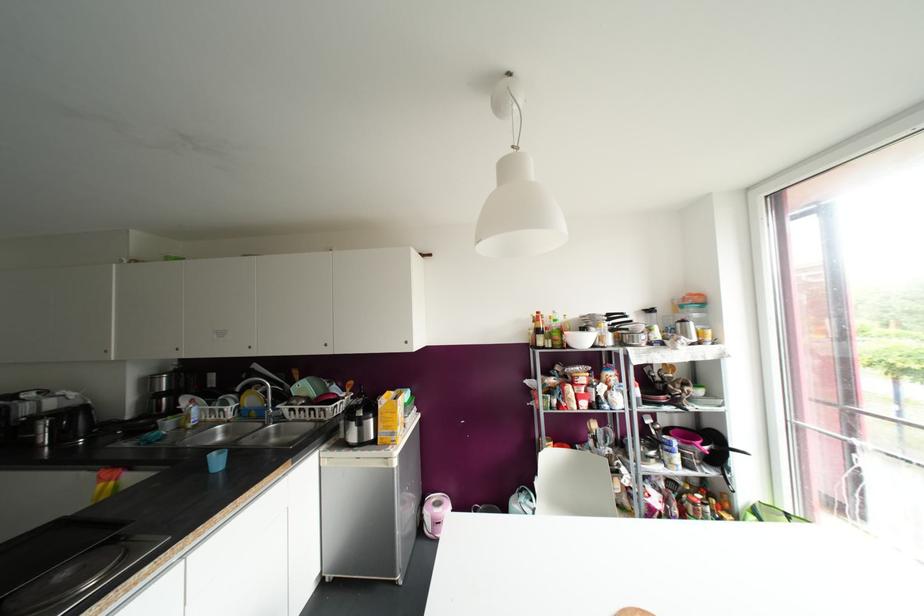
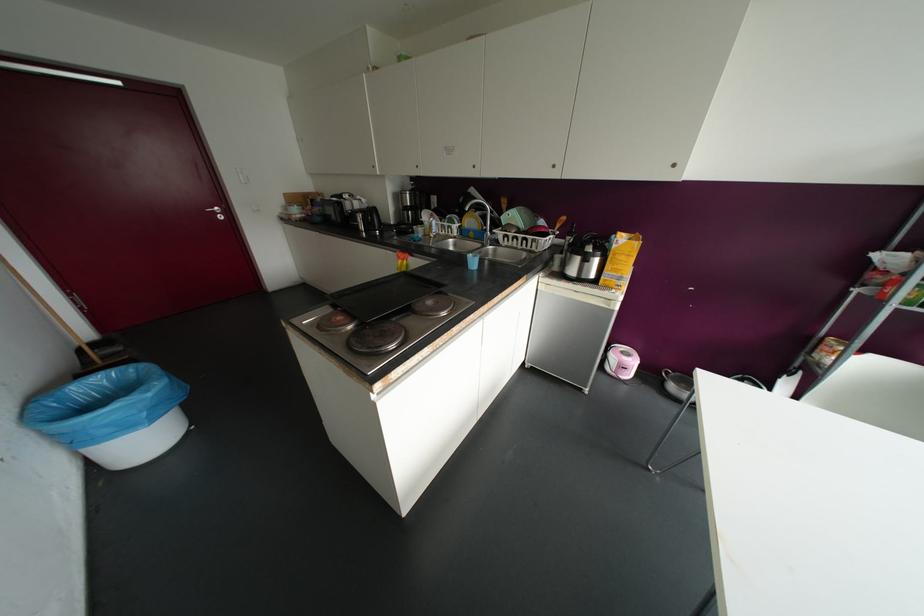
In the second image, find the point that corresponds to point 273,406 in the first image.

(490, 230)